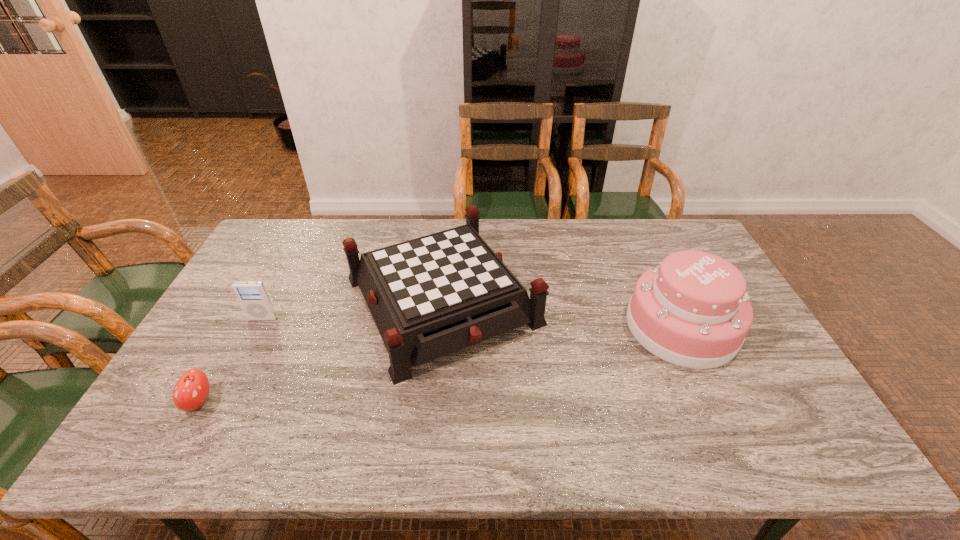
This screenshot has width=960, height=540. Find the location of `iPod situated at the left edge`. iPod situated at the left edge is located at coordinates point(252,295).

The image size is (960, 540). I want to click on apple located in the left edge section of the desktop, so click(x=191, y=390).

Locate an element on the screen. Image resolution: width=960 pixels, height=540 pixels. object situated at the right edge is located at coordinates (692, 310).

Identify the location of vacant space at the far edge of the desktop. (429, 222).

I want to click on vacant region at the near edge of the desktop, so click(x=756, y=460).

This screenshot has height=540, width=960. In the image, there is a desktop. What are the coordinates of `vacant space at the left edge` in the screenshot? It's located at click(x=290, y=273).

You are a GUI agent. You are given a task and a screenshot of the screen. Output one action in this format:
    pyautogui.click(x=<x>, y=<y>)
    Task: Click on the free region at the right edge
    Image resolution: width=960 pixels, height=540 pixels.
    Given the screenshot: What is the action you would take?
    pyautogui.click(x=811, y=420)

The height and width of the screenshot is (540, 960). I want to click on free spot at the far right corner of the desktop, so click(674, 222).

I want to click on free space at the near right corner of the desktop, so click(x=818, y=433).

Find the location of a particular element. This screenshot has width=960, height=540. blank region between the shortest object and the third tallest object is located at coordinates (231, 360).